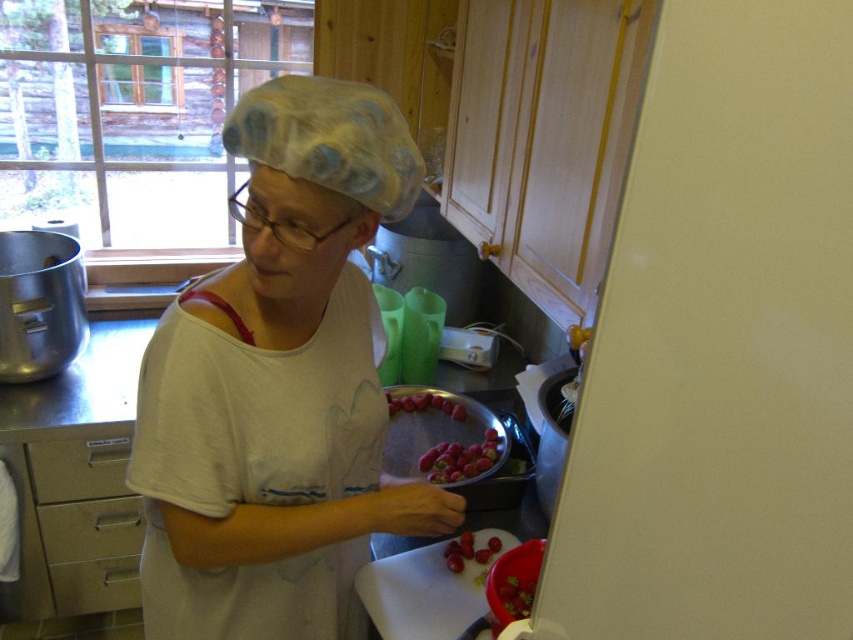
Does white matte hairnet at upper center appear on the right side of satin silver drawer at lower left?

Correct, you'll find white matte hairnet at upper center to the right of satin silver drawer at lower left.

Between white matte hairnet at upper center and satin silver drawer at lower left, which one appears on the right side from the viewer's perspective?

white matte hairnet at upper center

Where is `white matte hairnet at upper center`? The height and width of the screenshot is (640, 853). white matte hairnet at upper center is located at coordinates point(279,385).

Which is in front, point (367, 513) or point (503, 592)?

Point (367, 513) is more forward.

Measure the distance between white matte hairnet at upper center and camera.

white matte hairnet at upper center is 29.56 inches away from camera.

Where is `white matte hairnet at upper center`? The width and height of the screenshot is (853, 640). white matte hairnet at upper center is located at coordinates (279, 385).

Is ripe red grapes at center positioned behind shiny red strawberries at center?

No, it is not.

Can you confirm if ripe red grapes at center is positioned below shiny red strawberries at center?

Yes, ripe red grapes at center is below shiny red strawberries at center.

Is point (469, 451) farther from viewer compared to point (410, 397)?

That is False.

This screenshot has width=853, height=640. Find the location of `ripe red grapes at center`. ripe red grapes at center is located at coordinates (460, 460).